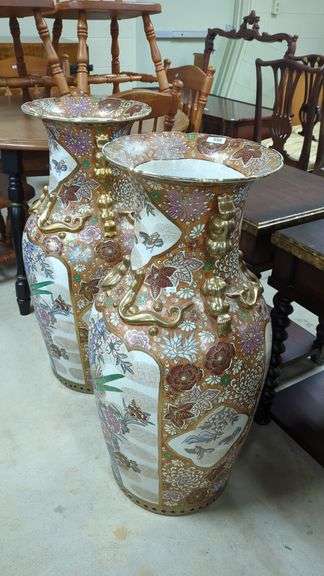
You are a GUI agent. You are given a task and a screenshot of the screen. Output one action in this format:
    pyautogui.click(x=<x>, y=<y>)
    Task: Click on the dark wood chairs
    
    Given the screenshot: What is the action you would take?
    pyautogui.click(x=304, y=245), pyautogui.click(x=293, y=184), pyautogui.click(x=314, y=58)